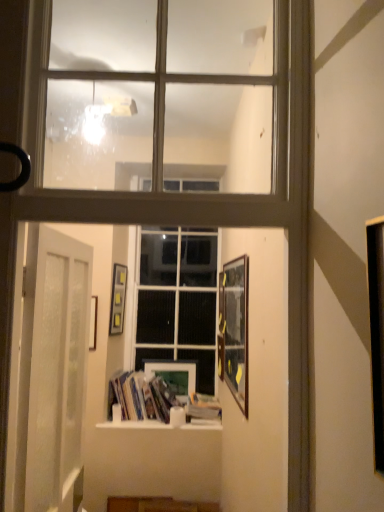
Question: Relative to wooden framed picture at right, arranged as the third picture frame when viewed from the back, is hardcover book at center in front or behind?

Choices:
 (A) front
 (B) behind

Answer: (B)

Question: From a real-world perspective, is hardcover book at center physically located above or below wooden framed picture at right, arranged as the third picture frame when viewed from the back?

Choices:
 (A) below
 (B) above

Answer: (A)

Question: Estimate the real-world distances between objects in this image. Which object is closer to the matte black picture frame at center, which ranks as the second picture frame in back-to-front order?

Choices:
 (A) clear glass window at upper center
 (B) hardcover book at center
 (C) matte wooden picture frame at center, the first picture frame viewed from the back
 (D) hardcover books at center
 (E) clear glass window at center

Answer: (E)

Question: Based on their relative distances, which object is farther from the hardcover book at center?

Choices:
 (A) hardcover books at center
 (B) clear glass window at center
 (C) wooden framed picture at right, arranged as the first picture frame when viewed from the front
 (D) clear glass window at upper center
 (E) matte wooden picture frame at center, the first picture frame viewed from the back

Answer: (D)